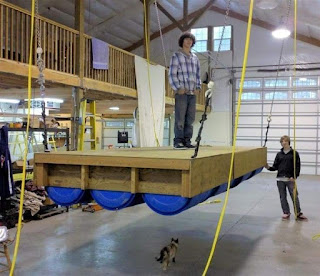
What are the coordinates of `window` in the screenshot? It's located at (214, 33), (201, 35), (251, 95), (252, 84), (282, 83), (278, 99), (305, 94), (302, 80), (115, 122), (129, 124).